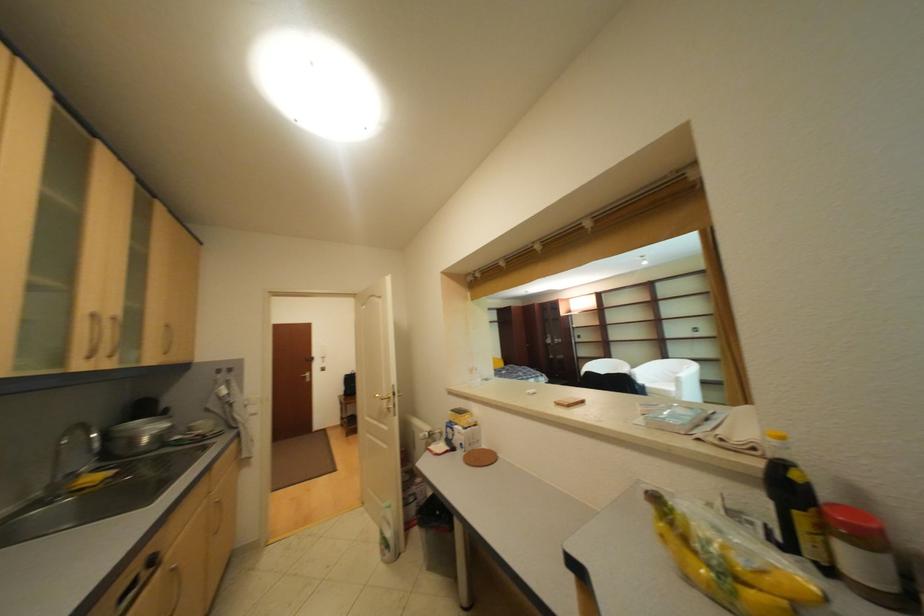
Find where to turn the faucet handle. Please return your answer as a coordinate pair (x, y).

(75, 448)